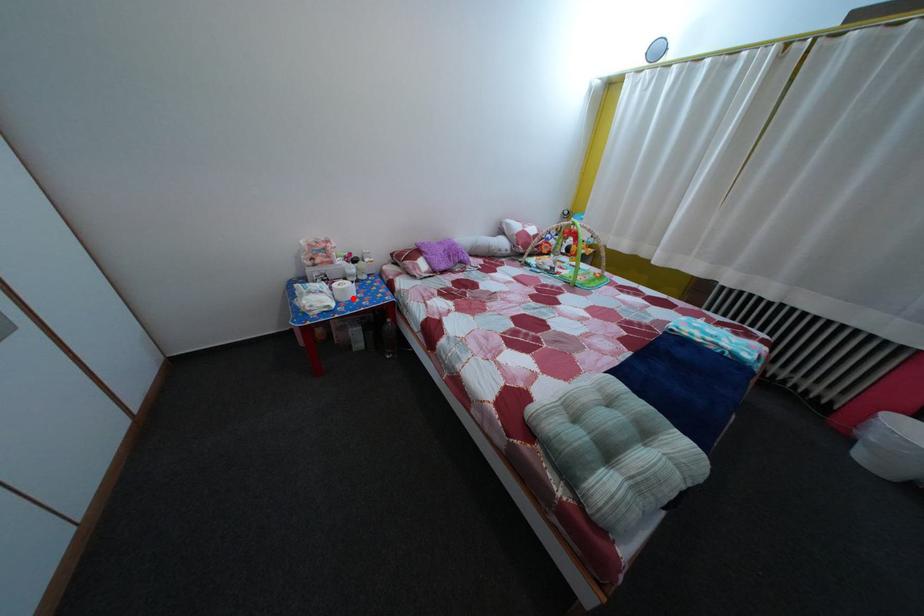
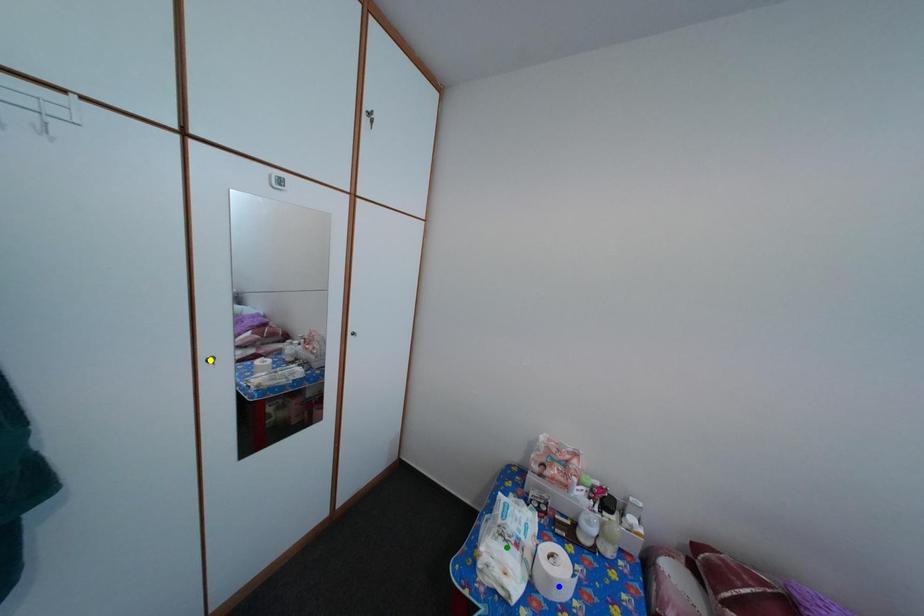
Question: I am providing you with two images of the same scene from different viewpoints. A red point is marked on the first image. You are given multiple points on the second image. Which point in image 2 is actually the same real-world point as the red point in image 1?

Choices:
 (A) green point
 (B) blue point
 (C) yellow point

Answer: (B)